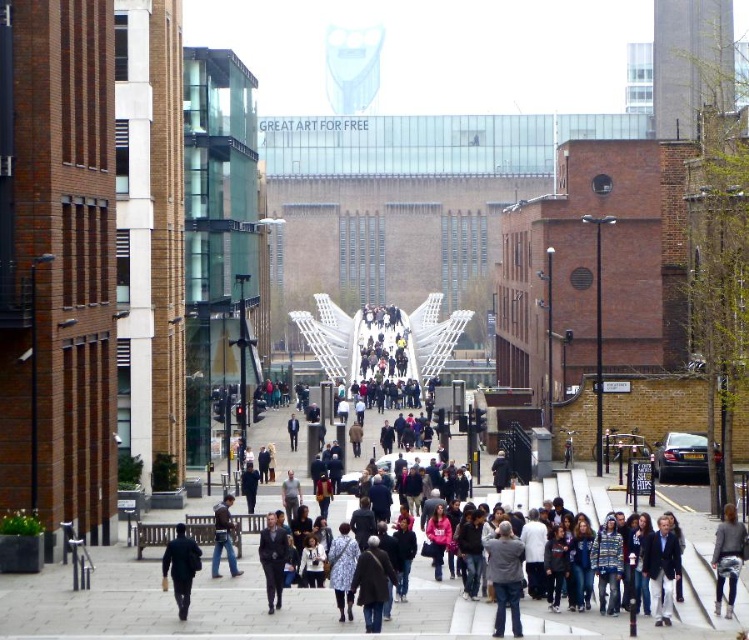
Question: Can you confirm if dark gray suit at center is wider than dark blue jeans at center?

Choices:
 (A) no
 (B) yes

Answer: (A)

Question: Which of the following is the farthest from the observer?

Choices:
 (A) dark blue suit at center
 (B) dark gray suit at center

Answer: (A)

Question: Is denim jacket at lower right positioned behind dark blue jeans at center?

Choices:
 (A) no
 (B) yes

Answer: (A)

Question: Considering the relative positions of denim jacket at lower right and dark blue jacket at lower left in the image provided, where is denim jacket at lower right located with respect to dark blue jacket at lower left?

Choices:
 (A) right
 (B) left

Answer: (A)

Question: Which object appears closest to the camera in this image?

Choices:
 (A) dark blue suit at center
 (B) dark gray suit at center
 (C) dark blue jeans at center

Answer: (B)

Question: Which object appears farthest from the camera in this image?

Choices:
 (A) denim jacket at lower right
 (B) dark blue jacket at lower left
 (C) dark gray suit at center
 (D) dark blue suit at center

Answer: (D)